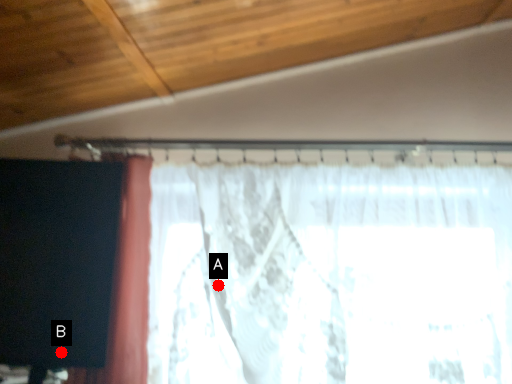
Question: Two points are circled on the image, labeled by A and B beside each circle. Which point is further to the camera?

Choices:
 (A) A is further
 (B) B is further

Answer: (A)